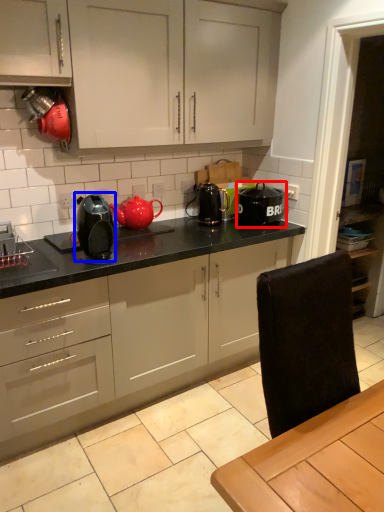
Question: Which object appears closest to the camera in this image, kitchen appliance (highlighted by a red box) or home appliance (highlighted by a blue box)?

Choices:
 (A) kitchen appliance
 (B) home appliance

Answer: (B)